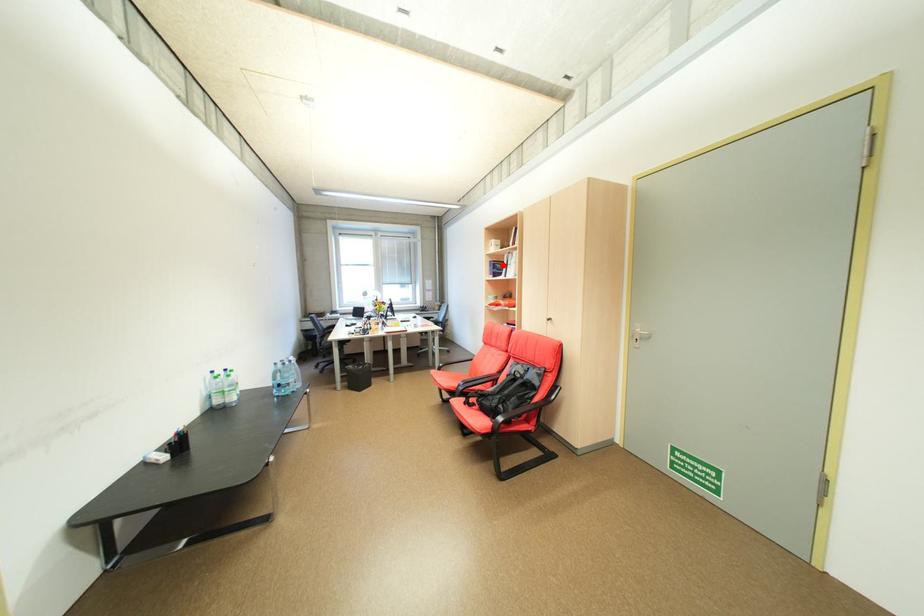
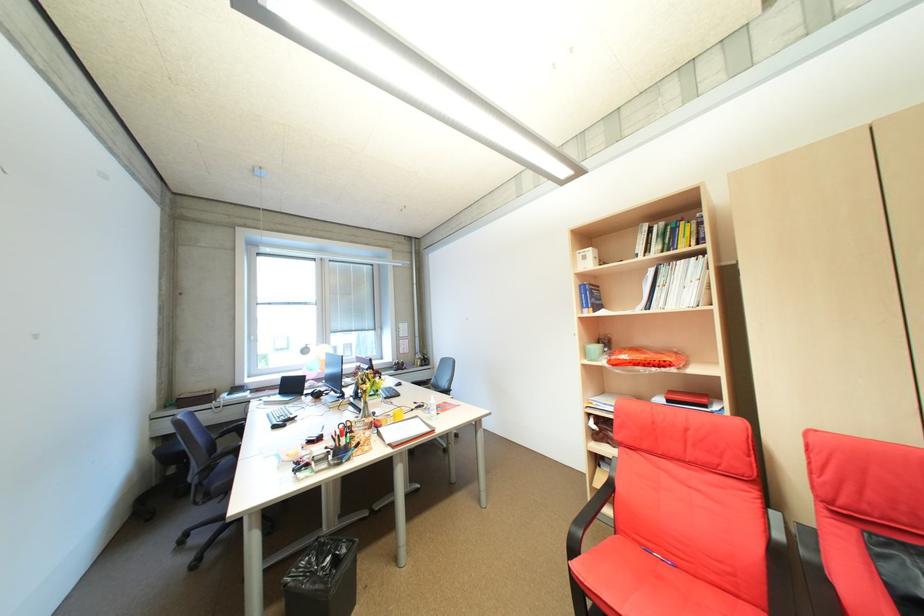
Locate, in the second image, the point that corresponds to the highlighted location in the first image.

(600, 291)